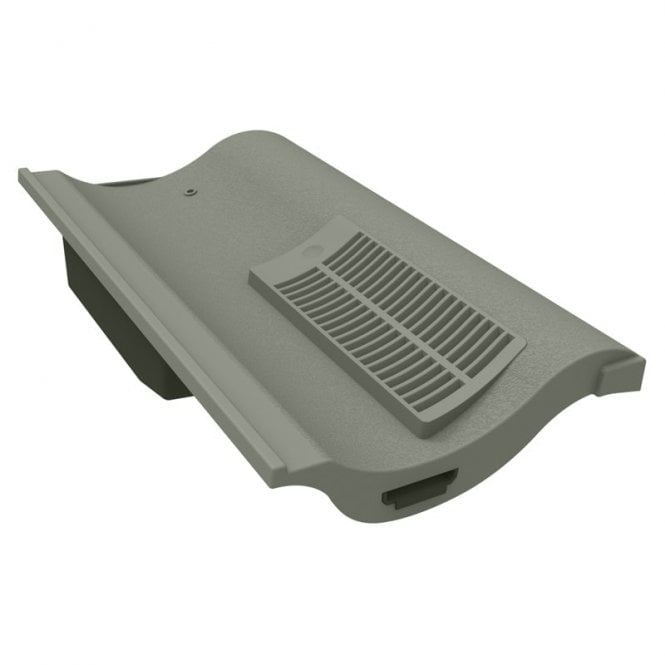
Identify the location of vent. Image resolution: width=665 pixels, height=665 pixels. (370, 340).